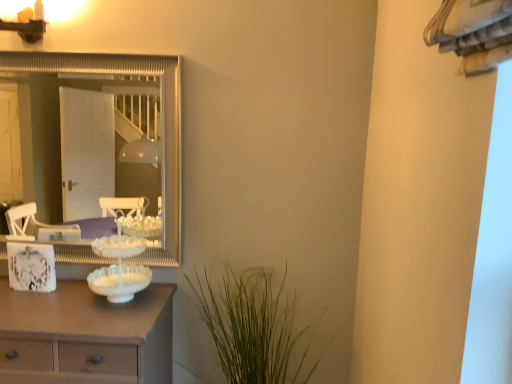
Question: Considering the relative sizes of white frosted glass candle holder at center and white wood chest of drawers at left in the image provided, is white frosted glass candle holder at center bigger than white wood chest of drawers at left?

Choices:
 (A) no
 (B) yes

Answer: (A)

Question: Is white wood chest of drawers at left located within white frosted glass candle holder at center?

Choices:
 (A) yes
 (B) no

Answer: (B)

Question: From a real-world perspective, is white frosted glass candle holder at center physically below white wood chest of drawers at left?

Choices:
 (A) yes
 (B) no

Answer: (B)

Question: Is white frosted glass candle holder at center in contact with white wood chest of drawers at left?

Choices:
 (A) yes
 (B) no

Answer: (B)

Question: Is white frosted glass candle holder at center far away from white wood chest of drawers at left?

Choices:
 (A) yes
 (B) no

Answer: (B)

Question: Considering the relative sizes of white frosted glass candle holder at center and white wood chest of drawers at left in the image provided, is white frosted glass candle holder at center smaller than white wood chest of drawers at left?

Choices:
 (A) no
 (B) yes

Answer: (B)

Question: Considering the relative sizes of white frosted glass candle holder at center and green leafy plant at lower center in the image provided, is white frosted glass candle holder at center taller than green leafy plant at lower center?

Choices:
 (A) yes
 (B) no

Answer: (B)

Question: Could you tell me if white frosted glass candle holder at center is facing green leafy plant at lower center?

Choices:
 (A) no
 (B) yes

Answer: (A)

Question: Is white frosted glass candle holder at center outside green leafy plant at lower center?

Choices:
 (A) yes
 (B) no

Answer: (A)

Question: Is white frosted glass candle holder at center in front of green leafy plant at lower center?

Choices:
 (A) yes
 (B) no

Answer: (B)

Question: Does white frosted glass candle holder at center appear on the right side of green leafy plant at lower center?

Choices:
 (A) no
 (B) yes

Answer: (A)

Question: Considering the relative positions of white frosted glass candle holder at center and green leafy plant at lower center in the image provided, is white frosted glass candle holder at center to the left of green leafy plant at lower center from the viewer's perspective?

Choices:
 (A) yes
 (B) no

Answer: (A)

Question: Considering the relative positions of green leafy plant at lower center and white frosted glass candle holder at center in the image provided, is green leafy plant at lower center to the left of white frosted glass candle holder at center from the viewer's perspective?

Choices:
 (A) yes
 (B) no

Answer: (B)